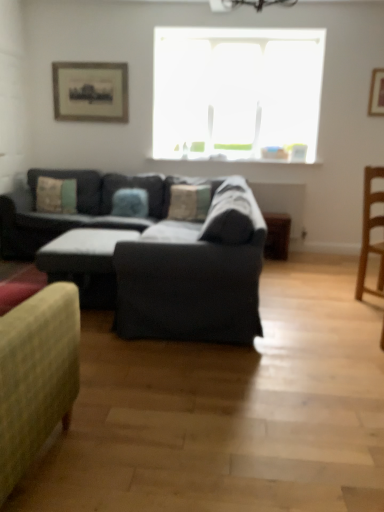
Question: Is light brown wooden chair at right bigger or smaller than textured beige pillow at left, which is counted as the 3th pillow, starting from the right?

Choices:
 (A) big
 (B) small

Answer: (A)

Question: Considering the positions of point click(x=360, y=253) and point click(x=71, y=186), is point click(x=360, y=253) closer or farther from the camera than point click(x=71, y=186)?

Choices:
 (A) farther
 (B) closer

Answer: (B)

Question: Based on their relative distances, which object is nearer to the textured fabric pillow at center, which ranks as the 1th pillow in right-to-left order?

Choices:
 (A) wooden framed print at upper left, positioned as the 1th picture frame in back-to-front order
 (B) transparent glass window at upper center
 (C) wooden picture frame at upper right, positioned as the first picture frame in front-to-back order
 (D) light brown wooden chair at right
 (E) dark gray fabric couch at center

Answer: (E)

Question: Estimate the real-world distances between objects in this image. Which object is closer to the transparent glass window at upper center?

Choices:
 (A) wooden side table at lower right
 (B) blue fabric pillow at center, which is the 2th pillow in left-to-right order
 (C) textured fabric pillow at center, which ranks as the 1th pillow in right-to-left order
 (D) wooden framed print at upper left, the 2th picture frame in the front-to-back sequence
 (E) dark gray fabric couch at center

Answer: (D)